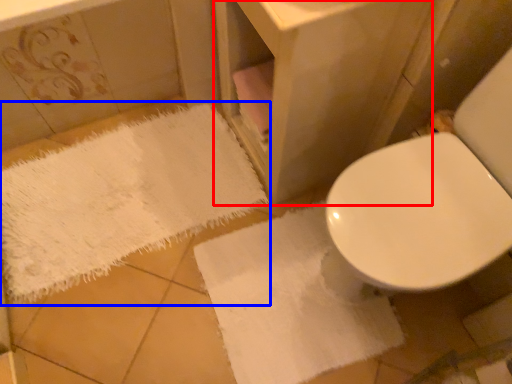
Question: Which of the following is the closest to the observer, vanity (highlighted by a red box) or bath towel (highlighted by a blue box)?

Choices:
 (A) vanity
 (B) bath towel

Answer: (A)